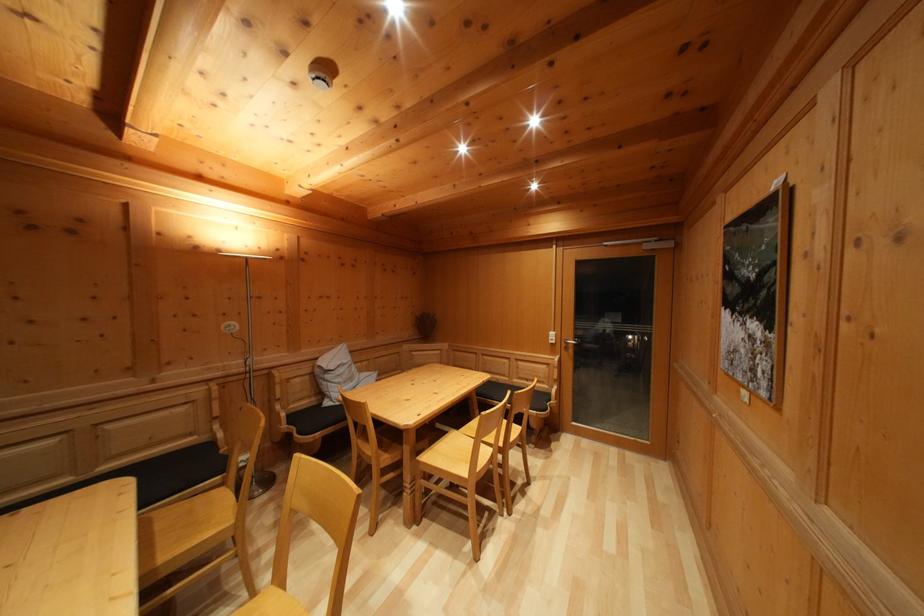
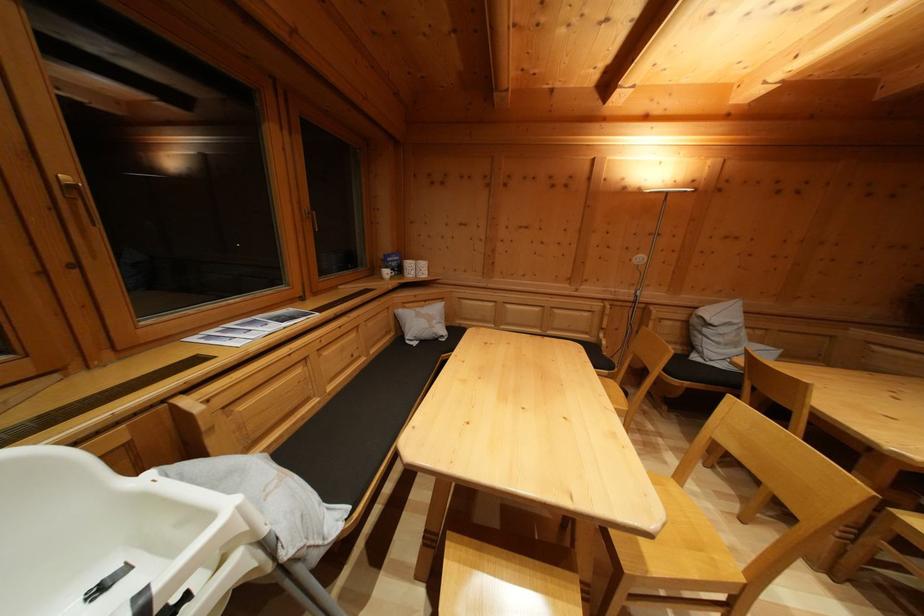
First-person continuous shooting, in which direction is the camera rotating?

The rotation direction of the camera is left-down.